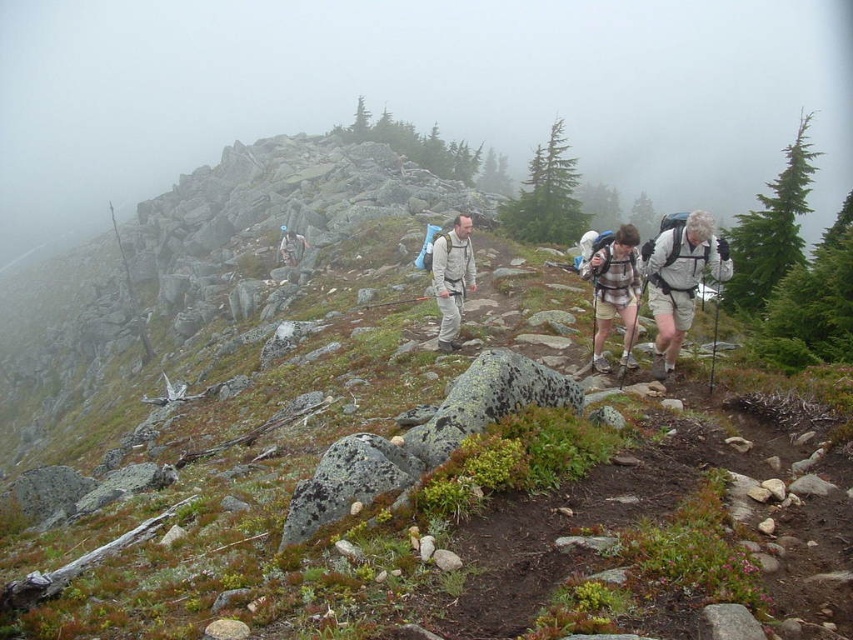
Is white matte backpack at right wider than striped fabric backpack at center?

No, white matte backpack at right is not wider than striped fabric backpack at center.

From the picture: Can you confirm if white matte backpack at right is thinner than striped fabric backpack at center?

Yes, white matte backpack at right is thinner than striped fabric backpack at center.

Identify the location of white matte backpack at right. The width and height of the screenshot is (853, 640). (680, 280).

Which is above, matte gray backpack at center or matte gray backpack at upper center?

matte gray backpack at upper center

Does matte gray backpack at center have a larger size compared to matte gray backpack at upper center?

Incorrect, matte gray backpack at center is not larger than matte gray backpack at upper center.

Who is more forward, (x=447, y=298) or (x=305, y=250)?

Point (x=447, y=298) is in front.

What are the coordinates of `matte gray backpack at center` in the screenshot? It's located at (451, 276).

Who is more forward, (596,272) or (462,250)?

Point (596,272)

Can you confirm if striped fabric backpack at center is shorter than matte gray backpack at center?

No.

Is point (612, 244) positioned in front of point (466, 232)?

That is True.

Where is `striped fabric backpack at center`? This screenshot has height=640, width=853. striped fabric backpack at center is located at coordinates (614, 291).